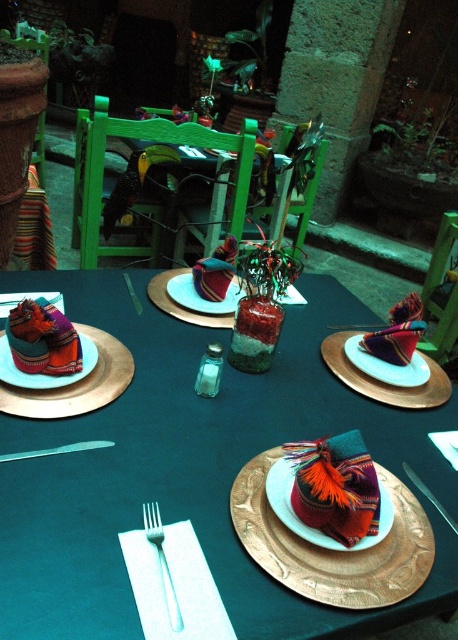
You are sitting at the table and want to reach both the point at (327, 352) and the point at (183, 310). Which point is closer to you?

Point (183, 310) is closer to you because it is behind point (327, 352), which is in front of it.

You are a guest at this outdoor dining table. You need to reach for the metallic knife at center to cut your bread. However, there is a gold metallic platter at center in the way. Based on their positions, can you easily access the knife without moving the platter?

The gold metallic platter at center is below the metallic knife at center, so the knife is positioned above the platter. This means you can easily access the metallic knife at center without needing to move the platter since it is above the platter.